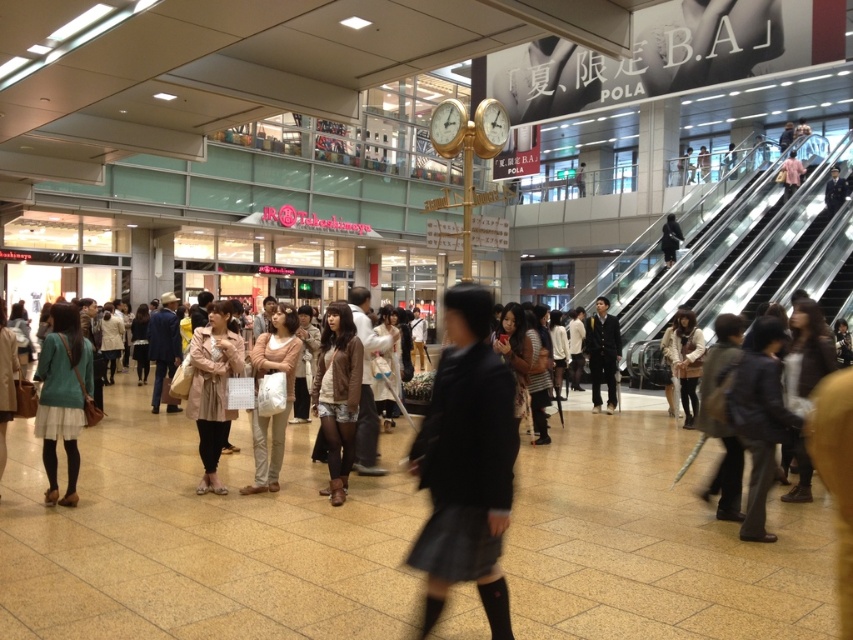
Is teal fabric skirt at lower left above black matte jacket at center?

No.

Can you confirm if teal fabric skirt at lower left is positioned to the left of black matte jacket at center?

Correct, you'll find teal fabric skirt at lower left to the left of black matte jacket at center.

Between point (70, 413) and point (672, 250), which one is positioned behind?

The point (672, 250) is more distant.

I want to click on teal fabric skirt at lower left, so click(62, 396).

Can you confirm if teal fabric skirt at lower left is wider than light beige pants at center?

Yes, teal fabric skirt at lower left is wider than light beige pants at center.

Is point (62, 380) less distant than point (254, 376)?

Yes, it is.

Between point (56, 339) and point (262, 353), which one is positioned behind?

Positioned behind is point (262, 353).

Identify the location of teal fabric skirt at lower left. This screenshot has height=640, width=853. click(62, 396).

Does light beige textured coat at center have a lesser height compared to leather jacket at center?

No.

Where is `light beige textured coat at center`? light beige textured coat at center is located at coordinates point(213,387).

Where is `light beige textured coat at center`? light beige textured coat at center is located at coordinates (213, 387).

Where is `light beige textured coat at center`? This screenshot has width=853, height=640. light beige textured coat at center is located at coordinates (213, 387).